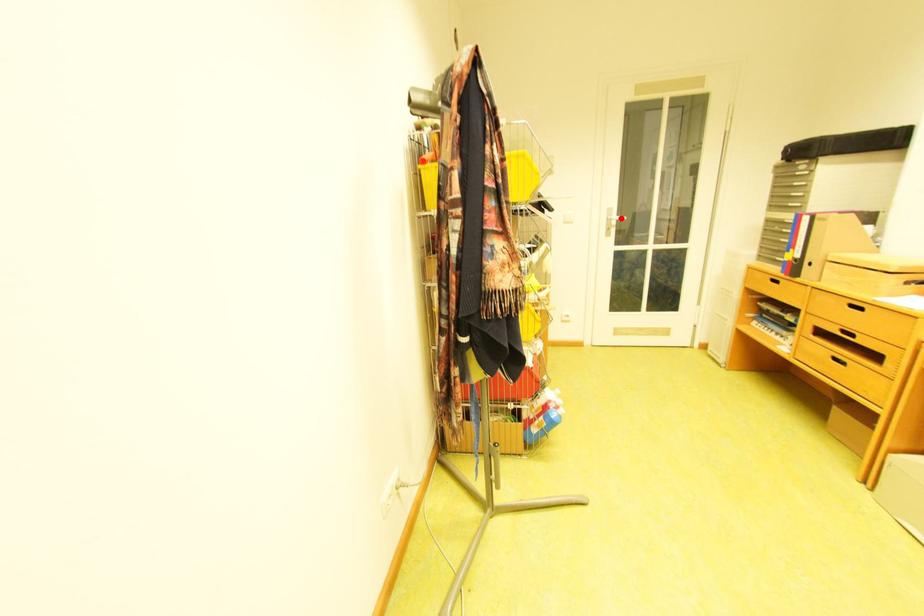
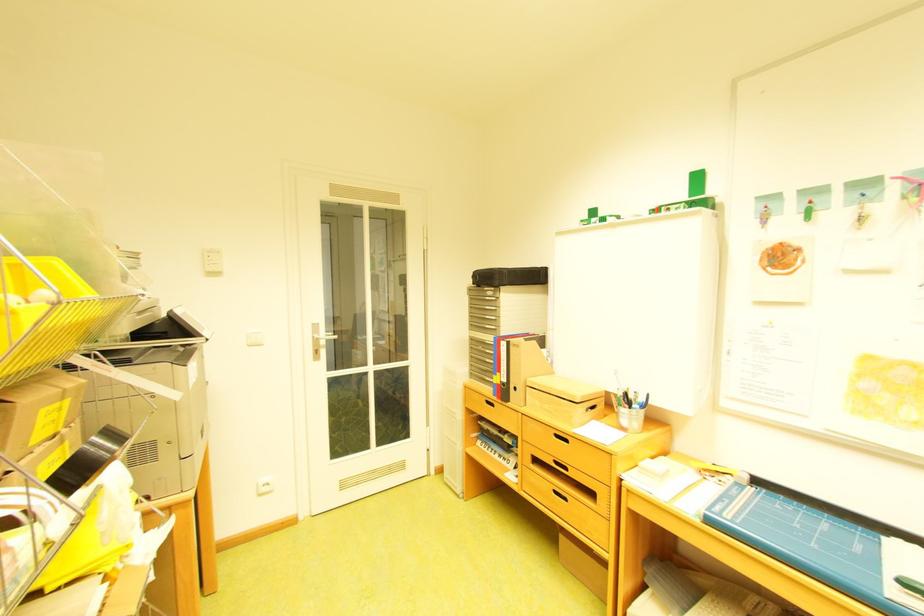
The point at the highlighted location is marked in the first image. Where is the corresponding point in the second image?

(327, 337)